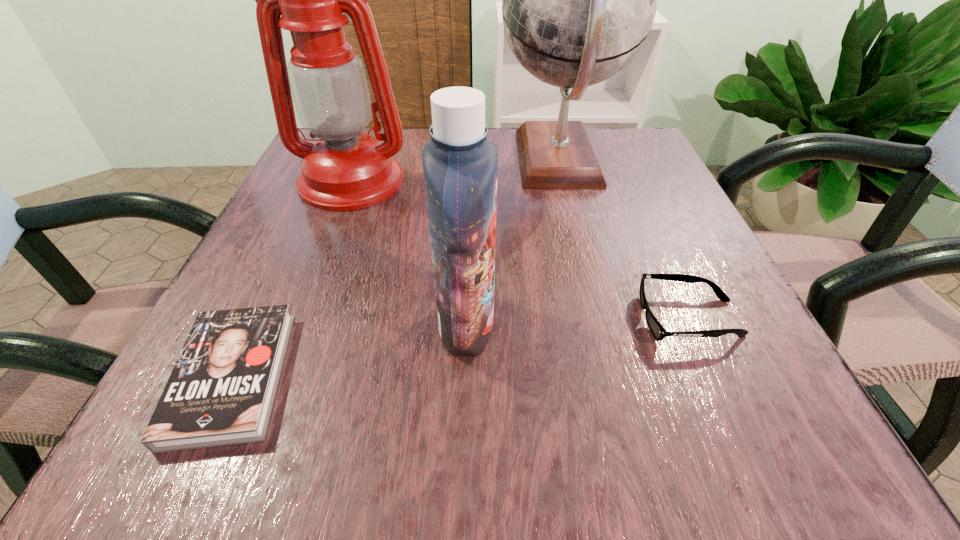
Identify the location of vacant space at the near right corner. (715, 406).

The height and width of the screenshot is (540, 960). I want to click on vacant space that's between the shortest object and the globe, so click(x=396, y=268).

Identify the location of free point between the third object from left to right and the book. (349, 350).

Where is `free space that is in between the third tallest object and the oil lamp`? free space that is in between the third tallest object and the oil lamp is located at coordinates (409, 252).

Locate an element on the screen. empty space between the oil lamp and the second shortest object is located at coordinates (520, 249).

The height and width of the screenshot is (540, 960). I want to click on free spot between the book and the third tallest object, so click(349, 350).

Locate an element on the screen. This screenshot has width=960, height=540. empty space that is in between the globe and the shortest object is located at coordinates (396, 268).

What are the coordinates of `free space between the globe and the shortest object` in the screenshot? It's located at (396, 268).

Where is `vacant area that lies between the fourth tallest object and the oil lamp`? Image resolution: width=960 pixels, height=540 pixels. vacant area that lies between the fourth tallest object and the oil lamp is located at coordinates (520, 249).

The width and height of the screenshot is (960, 540). What are the coordinates of `free space between the third tallest object and the sunglasses` in the screenshot? It's located at (577, 321).